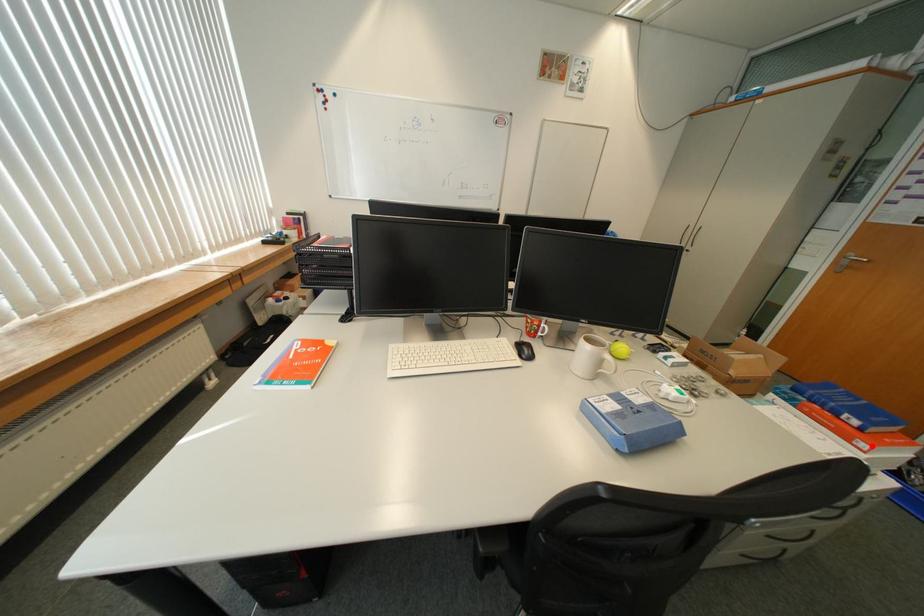
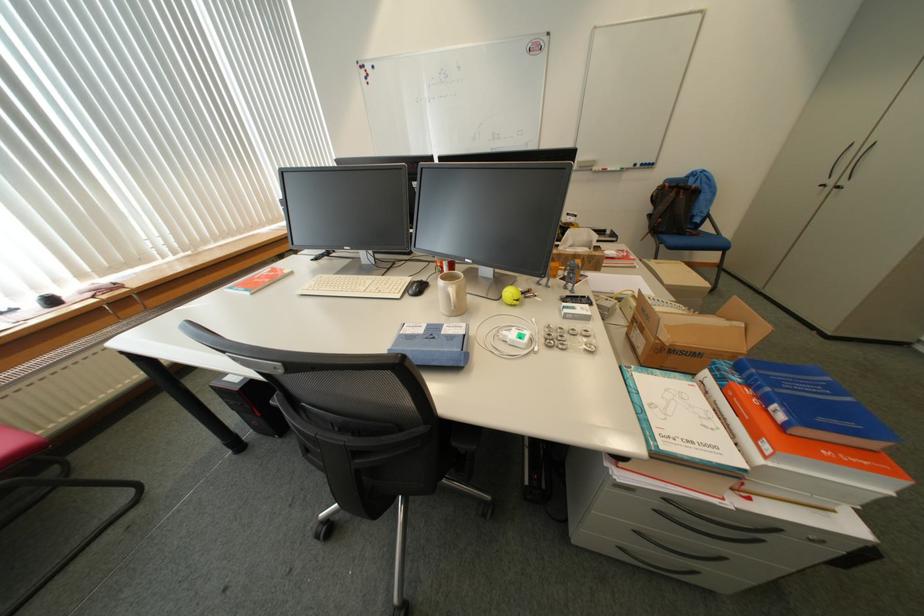
In the second image, find the point that corresponds to the highlighted location in the first image.

(775, 448)